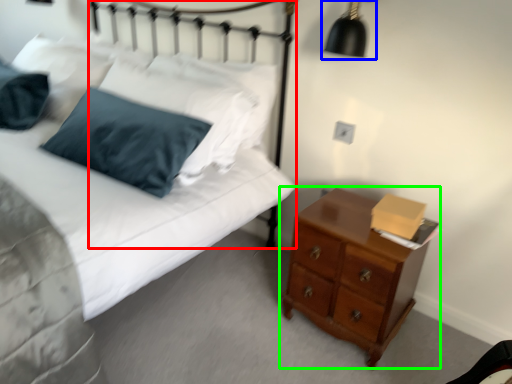
Question: Based on their relative distances, which object is farther from headboard (highlighted by a red box)? Choose from lamp (highlighted by a blue box) and chest of drawers (highlighted by a green box).

Choices:
 (A) lamp
 (B) chest of drawers

Answer: (B)